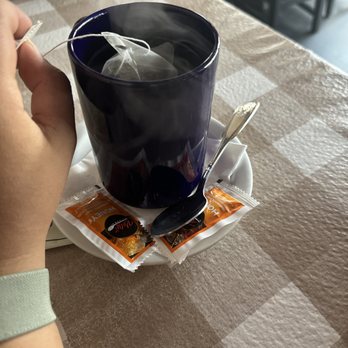
The height and width of the screenshot is (348, 348). In order to click on floor in this screenshot , I will do `click(334, 46)`.